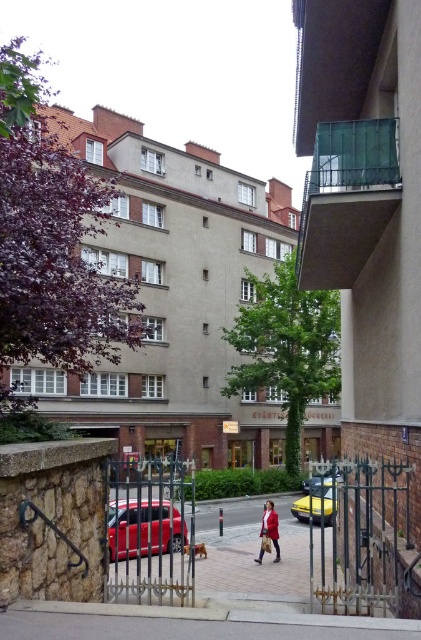
Question: Which object is the closest to the matte red coat at center?

Choices:
 (A) paved stone pavement at center
 (B) shiny red car at center

Answer: (B)

Question: Which object is the farthest from the matte red coat at center?

Choices:
 (A) shiny red car at center
 (B) yellow metallic car at center
 (C) paved concrete pavement at center

Answer: (C)

Question: Does paved stone pavement at center have a smaller size compared to metallic yellow car at center?

Choices:
 (A) no
 (B) yes

Answer: (B)

Question: Considering the relative positions of shiny red car at center and metallic yellow car at center in the image provided, where is shiny red car at center located with respect to metallic yellow car at center?

Choices:
 (A) left
 (B) right

Answer: (A)

Question: Among these points, which one is farthest from the camera?

Choices:
 (A) (303, 518)
 (B) (311, 481)
 (C) (151, 506)
 (D) (208, 564)

Answer: (B)

Question: Is paved stone pavement at center behind paved concrete pavement at center?

Choices:
 (A) no
 (B) yes

Answer: (B)